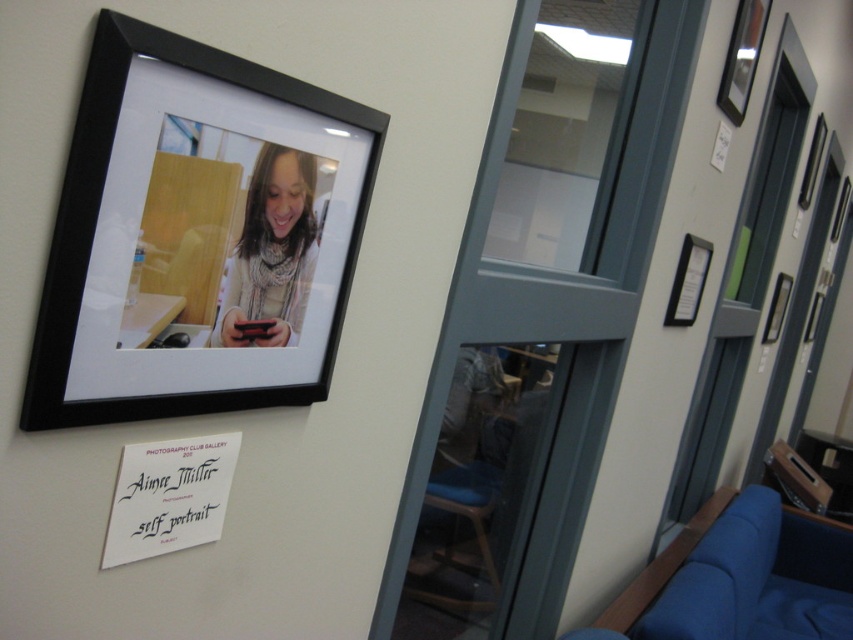
You are an art student who wants to hang a new matte black phone at center and a matte black picture frame at upper right in your dorm room. The wall space you have is limited. Based on the scene, which object would require more wall space?

The matte black picture frame at upper right requires more wall space because it is larger than the matte black phone at center.

You are an art student analyzing the framed photograph in the hallway. You need to determine the exact coordinates of the matte black phone at center in the image. What are they?

The coordinates of the matte black phone at center are at point (271, 252).

Consider the image. You are hanging a new picture frame that is 30 centimeters wide on the wall in the hallway. The black matte picture frame at upper left is already mounted. If you want to place the new frame so that there is exactly 30 centimeters of space between them, where should you position the new frame?

Place the new frame 30 centimeters to the right of the black matte picture frame at upper left. Since the existing frame is at upper left, positioning the new frame 30 centimeters to its right will create the desired spacing.